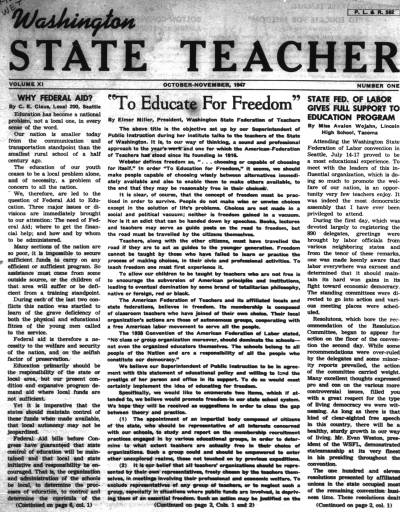
Image resolution: width=400 pixels, height=512 pixels. I want to click on newspaper, so click(239, 19).